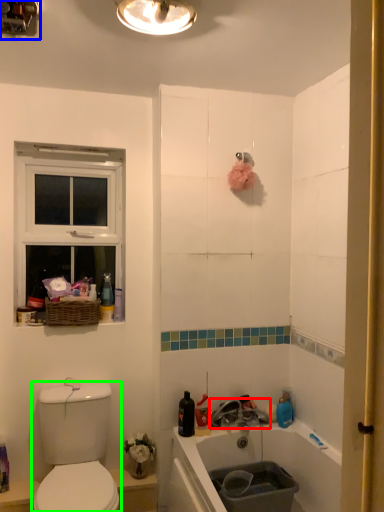
Question: Which object is positioned farthest from tap (highlighted by a red box)? Select from light fixture (highlighted by a blue box) and sink (highlighted by a green box).

Choices:
 (A) light fixture
 (B) sink

Answer: (A)